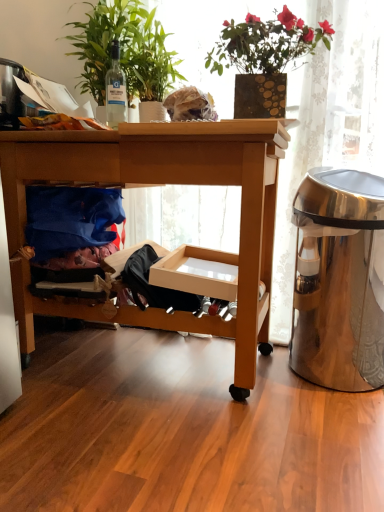
Question: From the image's perspective, is green glossy plant at upper left, the first houseplant from the left, above or below satin silver trash can at right?

Choices:
 (A) above
 (B) below

Answer: (A)

Question: Is green glossy plant at upper left, which ranks as the 2th houseplant in right-to-left order, bigger or smaller than satin silver trash can at right?

Choices:
 (A) big
 (B) small

Answer: (B)

Question: Which object is positioned closest to the clear glass bottle at upper left?

Choices:
 (A) wooden desk at center
 (B) wooden vase with flowers at upper center, acting as the 2th houseplant starting from the left
 (C) satin silver trash can at right
 (D) blue fabric at lower left
 (E) green glossy plant at upper left, the first houseplant from the left

Answer: (E)

Question: Estimate the real-world distances between objects in this image. Which object is farther from the wooden vase with flowers at upper center, the 1th houseplant in the right-to-left sequence?

Choices:
 (A) green glossy plant at upper left, which ranks as the 2th houseplant in right-to-left order
 (B) clear glass bottle at upper left
 (C) blue fabric at lower left
 (D) satin silver trash can at right
 (E) wooden desk at center

Answer: (C)